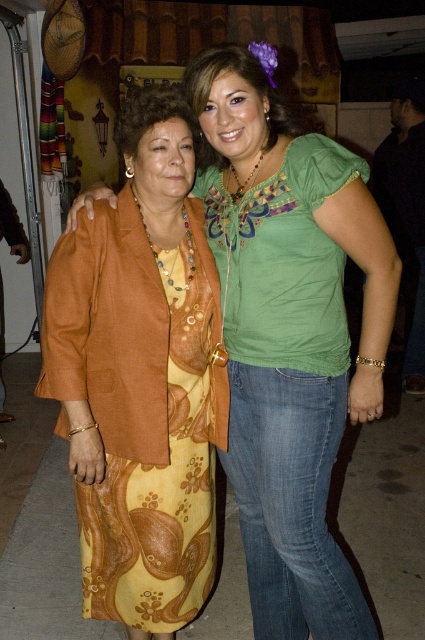
Is the position of matte orange dress at center more distant than that of yellow floral dress at center?

No.

Does matte orange dress at center have a smaller size compared to yellow floral dress at center?

Incorrect, matte orange dress at center is not smaller in size than yellow floral dress at center.

Where is `matte orange dress at center`? The width and height of the screenshot is (425, 640). matte orange dress at center is located at coordinates (289, 333).